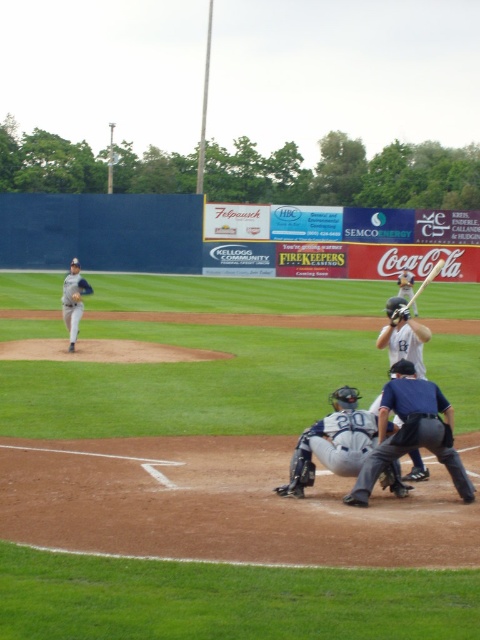
Based on the photo, you are a spectator at the baseball game and want to take a photo of both the gray matte uniform at center and the brown leather glove at center. Which object should you focus on first to ensure both are in the frame?

You should focus on the gray matte uniform at center first because it is positioned to the right of the brown leather glove at center, so by centering the gray matte uniform at center, the brown leather glove at center will naturally be included in the frame to its left.